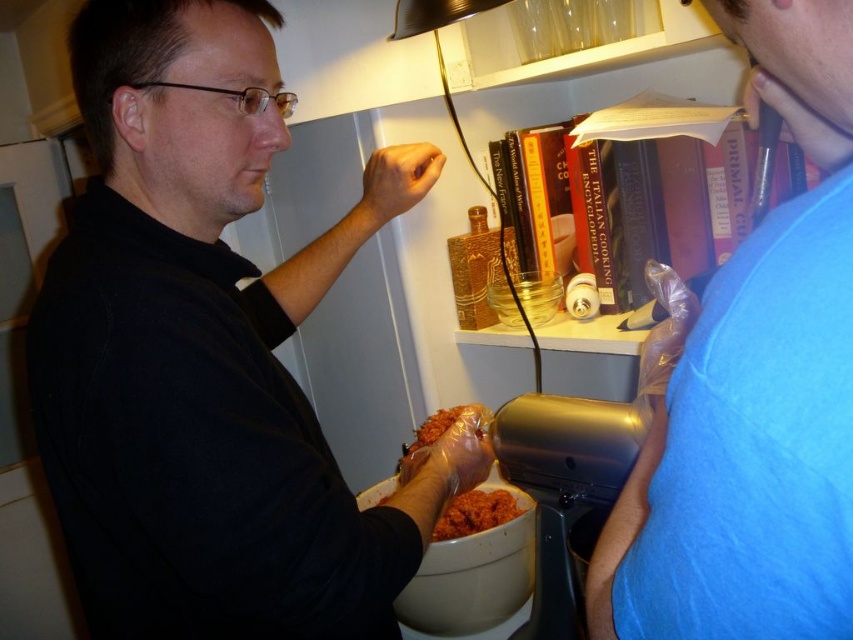
Question: Considering the real-world distances, which object is farthest from the black matte shirt at center?

Choices:
 (A) blue fabric shirt at upper right
 (B) reddish-brown paste at center
 (C) shiny plastic food at center

Answer: (A)

Question: Can you confirm if blue fabric shirt at upper right is thinner than shiny plastic food at center?

Choices:
 (A) yes
 (B) no

Answer: (B)

Question: Which object is closer to the camera taking this photo?

Choices:
 (A) shiny plastic food at center
 (B) reddish-brown paste at center
 (C) blue fabric shirt at upper right
 (D) black matte shirt at center

Answer: (C)

Question: Which of the following is the closest to the observer?

Choices:
 (A) blue fabric shirt at upper right
 (B) reddish-brown paste at center

Answer: (A)

Question: Where is black matte shirt at center located in relation to blue fabric shirt at upper right in the image?

Choices:
 (A) right
 (B) left

Answer: (B)

Question: Does black matte shirt at center have a larger size compared to shiny plastic food at center?

Choices:
 (A) yes
 (B) no

Answer: (A)